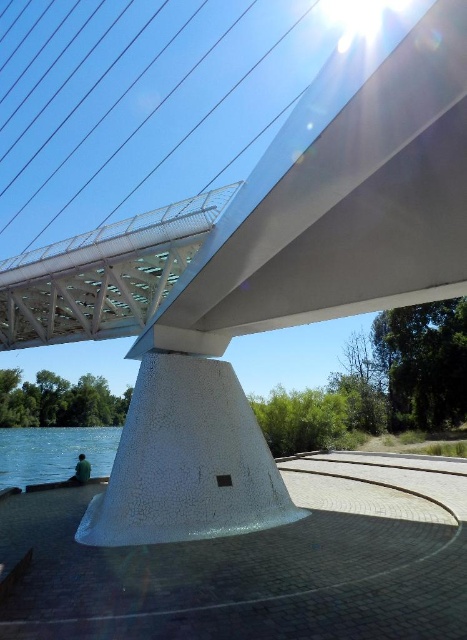
Between blue water at lower left and dark green fabric at lower left, which one has less height?

dark green fabric at lower left is shorter.

Find the location of `blue water at lower left`. blue water at lower left is located at coordinates (54, 452).